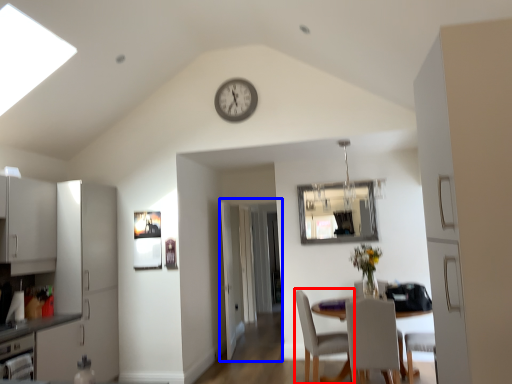
Question: Which point is closer to the camera, chair (highlighted by a red box) or glass door (highlighted by a blue box)?

Choices:
 (A) chair
 (B) glass door

Answer: (A)